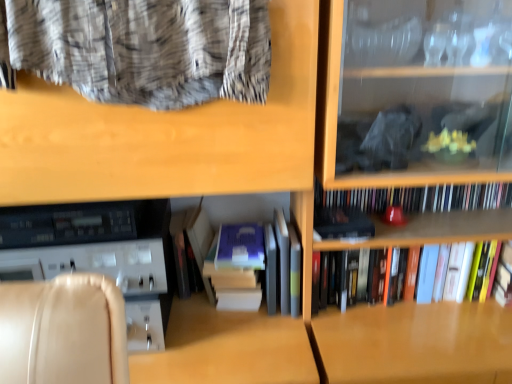
Question: From the image's perspective, relative to hardcover books at center, which is the 1th book in bottom-to-top order, is matte black book at center, marked as the first paperback book in a right-to-left arrangement, above or below?

Choices:
 (A) above
 (B) below

Answer: (A)

Question: From a real-world perspective, is matte black book at center, the second paperback book viewed from the left, positioned above or below hardcover books at center, which is the third book from top to bottom?

Choices:
 (A) below
 (B) above

Answer: (B)

Question: Which is farther from the hardcover book at center, arranged as the 2th book when ordered from the bottom?

Choices:
 (A) blue matte paperback book at center, the first paperback book in the left-to-right sequence
 (B) matte black book at center, marked as the first paperback book in a right-to-left arrangement
 (C) hardcover books at center, which appears as the third book when ordered from the bottom
 (D) hardcover books at center, which is the third book from top to bottom

Answer: (C)

Question: Which object is the closest to the blue matte paperback book at center, the 2th paperback book when ordered from right to left?

Choices:
 (A) hardcover books at center, the first book positioned from the top
 (B) hardcover book at center, arranged as the 2th book when ordered from the bottom
 (C) hardcover books at center, which is the third book from top to bottom
 (D) matte black book at center, marked as the first paperback book in a right-to-left arrangement

Answer: (B)